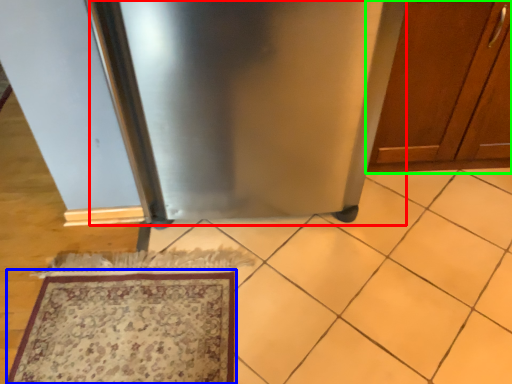
Question: Which is farther away from appliance (highlighted by a red box)? mat (highlighted by a blue box) or cabinetry (highlighted by a green box)?

Choices:
 (A) mat
 (B) cabinetry

Answer: (A)